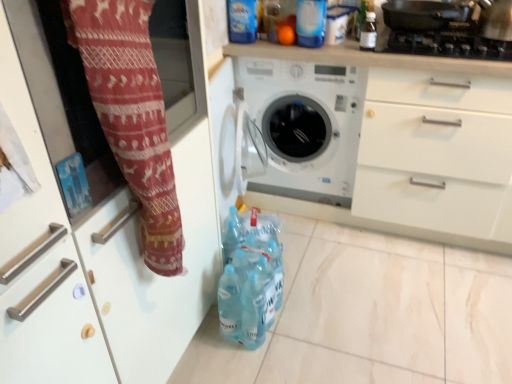
Identify the location of free location in front of white plastic washing machine at center. The image size is (512, 384). (353, 261).